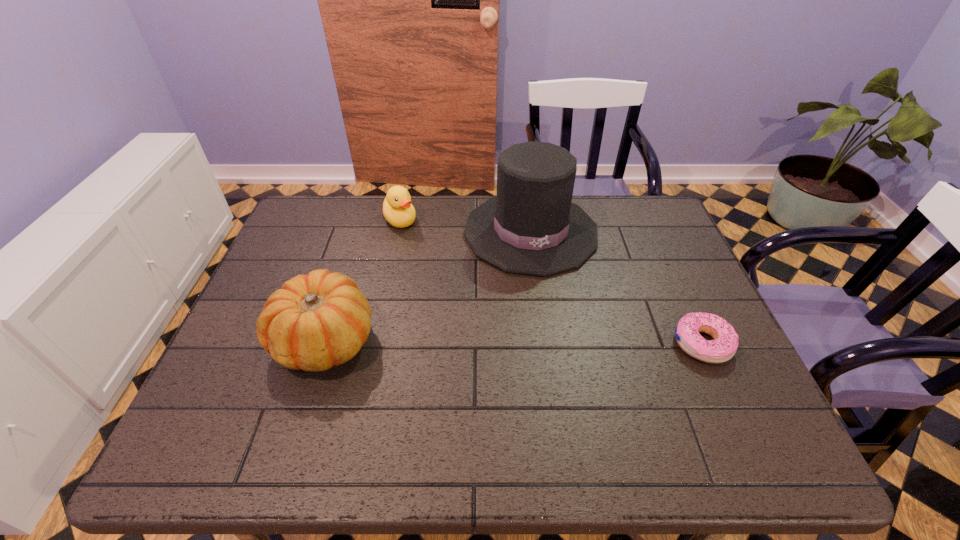
Where is `vacant position in the image that satisfies the following two spatial constraints: 1. on the front side of the second object from right to left; 2. on the right side of the third tallest object`? vacant position in the image that satisfies the following two spatial constraints: 1. on the front side of the second object from right to left; 2. on the right side of the third tallest object is located at coordinates (397, 232).